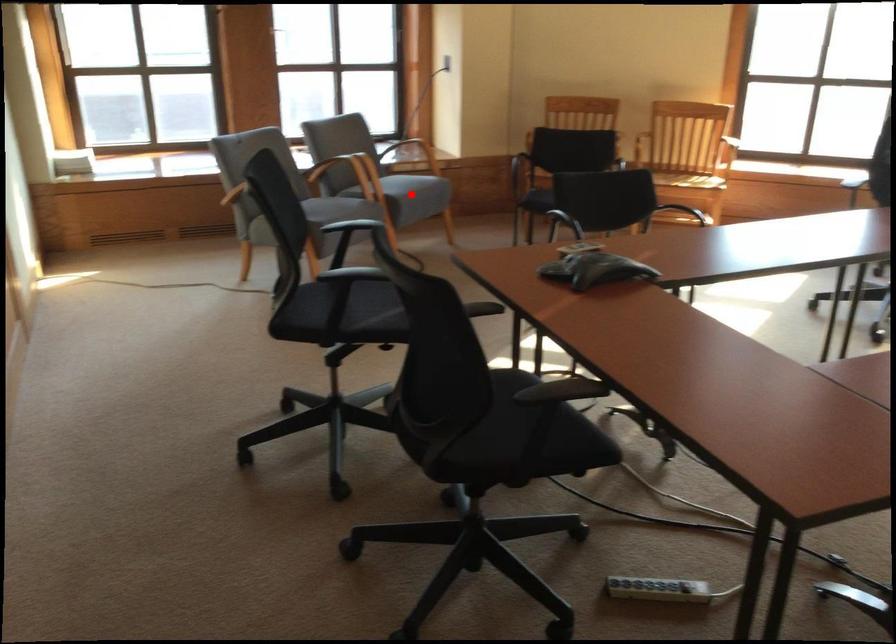
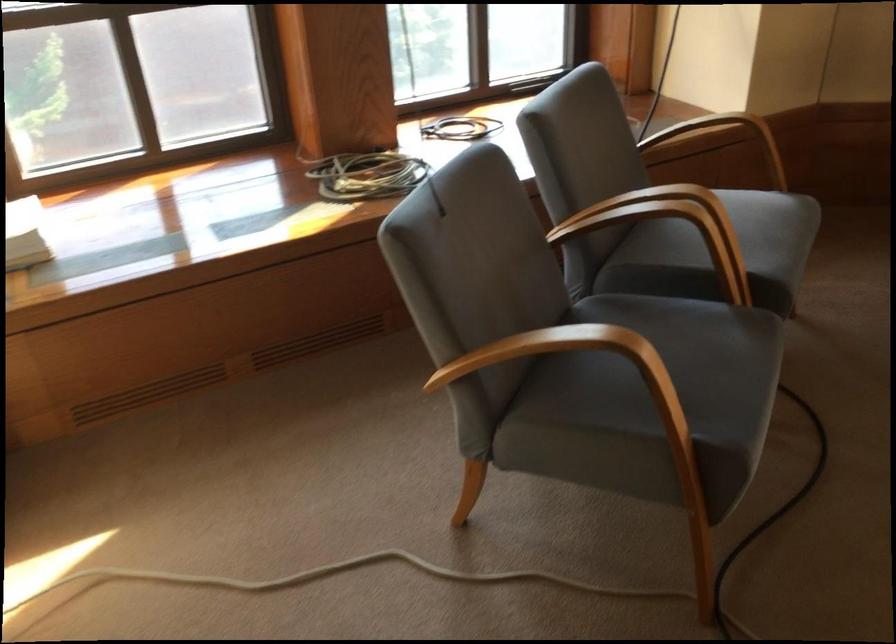
Question: I am providing you with two images of the same scene from different viewpoints. A red point is marked on the first image. At the location where the point appears in image 1, is it still visible in image 2?

Choices:
 (A) Yes
 (B) No

Answer: (B)